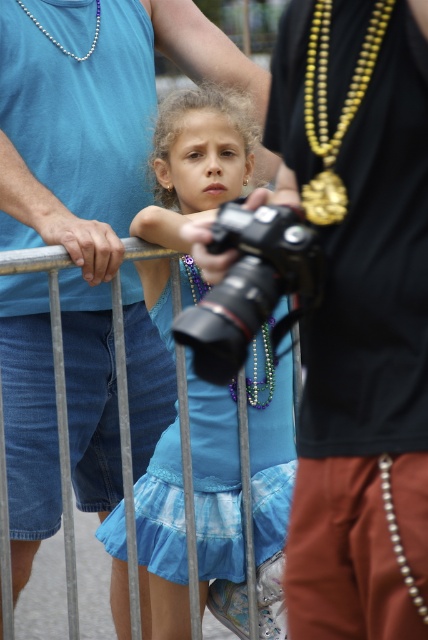
Between point (177, 435) and point (303, 99), which one is positioned in front?

Point (303, 99) is more forward.

Based on the photo, can you confirm if blue satin dress at center is shorter than gold metallic necklace at upper right?

Incorrect, blue satin dress at center's height does not fall short of gold metallic necklace at upper right's.

Is point (195, 392) behind point (323, 220)?

Yes, point (195, 392) is behind point (323, 220).

I want to click on blue satin dress at center, so click(196, 157).

Who is taller, blue satin dress at center or black plastic camera at center?

Standing taller between the two is blue satin dress at center.

Describe the element at coordinates (196, 157) in the screenshot. I see `blue satin dress at center` at that location.

The width and height of the screenshot is (428, 640). Find the location of `blue satin dress at center`. blue satin dress at center is located at coordinates (196, 157).

Is blue satin dress at center shorter than pearl necklace at upper left?

No, blue satin dress at center is not shorter than pearl necklace at upper left.

Is blue satin dress at center to the right of pearl necklace at upper left from the viewer's perspective?

Yes, blue satin dress at center is to the right of pearl necklace at upper left.

Is point (198, 504) closer to camera compared to point (38, 22)?

Yes, it is.

Where is `blue satin dress at center`? Image resolution: width=428 pixels, height=640 pixels. blue satin dress at center is located at coordinates (196, 157).